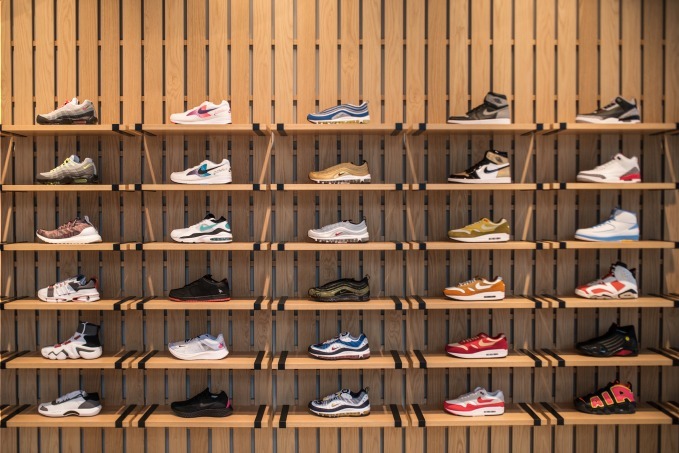
This screenshot has height=453, width=679. Identify the location of horizontal wall supports. (339, 40), (314, 98), (295, 150), (295, 205), (295, 263), (295, 317).